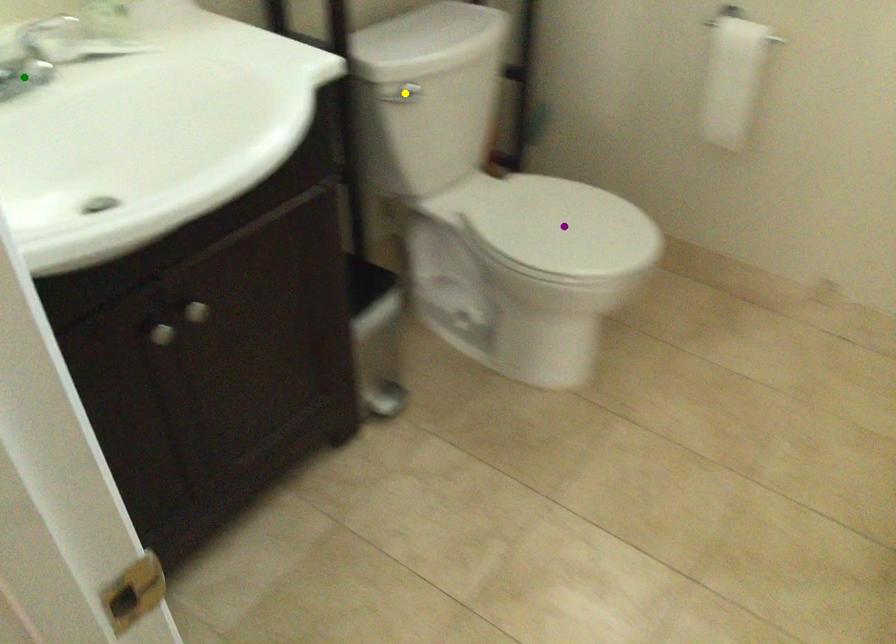
Order these from nearest to farthest:
yellow point, green point, purple point

purple point
yellow point
green point